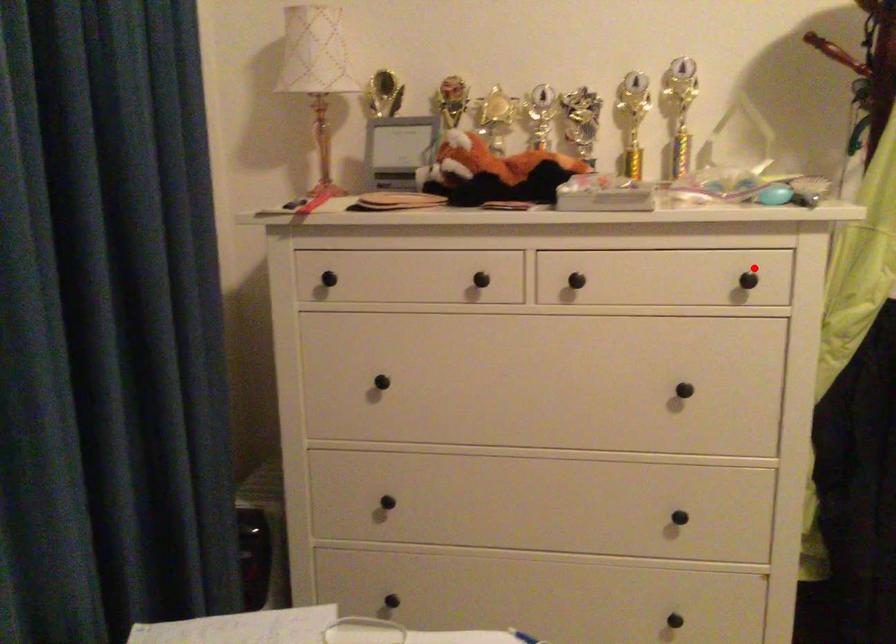
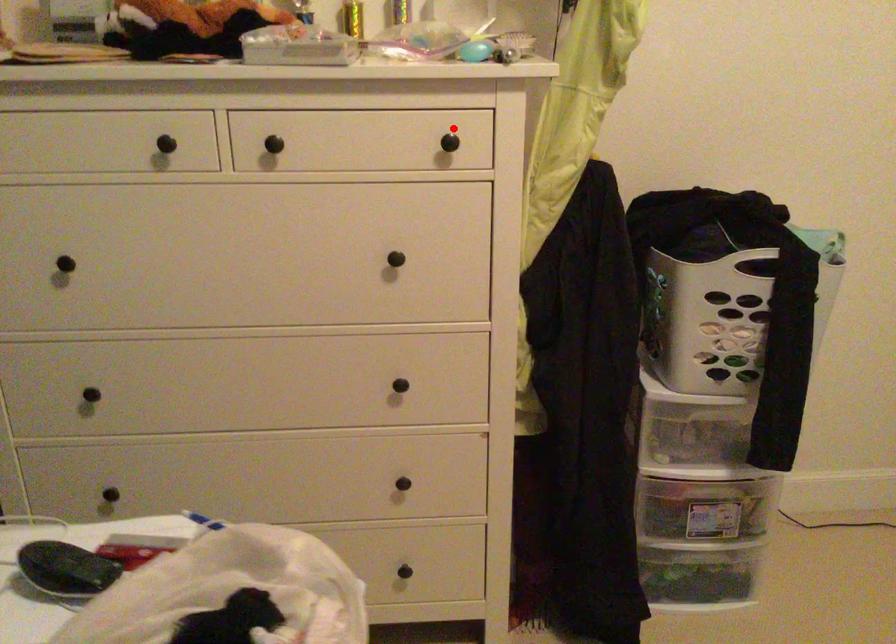
I am providing you with two images of the same scene from different viewpoints. A red point is marked on the first image and another point is marked on the second image. Does the point marked in image1 correspond to the same location as the one in image2?

Yes